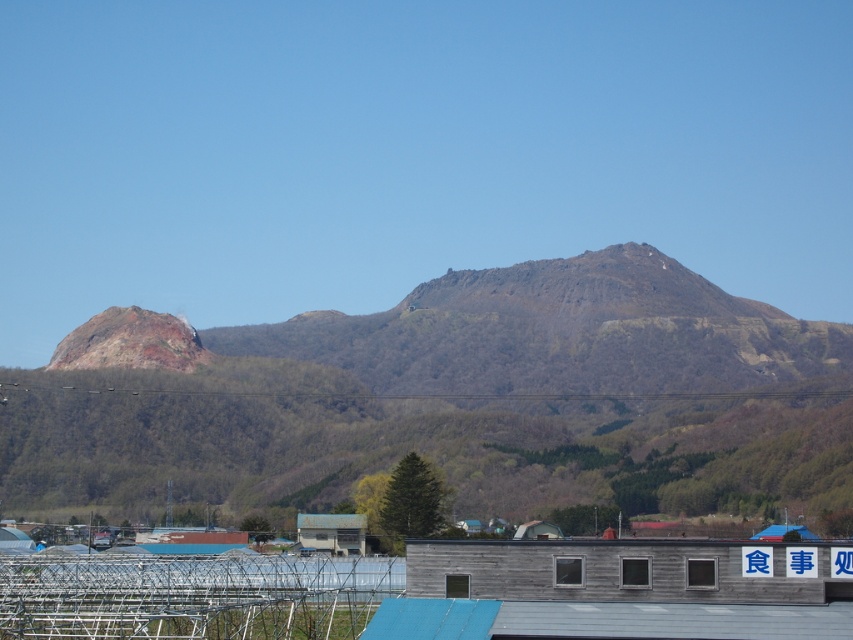
Question: Can you confirm if wooden hut at lower center is wider than rusty metallic rock at left?

Choices:
 (A) yes
 (B) no

Answer: (B)

Question: Does rustic brown mountain range at center appear on the left side of rusty metallic rock at left?

Choices:
 (A) no
 (B) yes

Answer: (A)

Question: Which point appears farthest from the camera in this image?

Choices:
 (A) (102, 342)
 (B) (358, 528)
 (C) (415, 292)

Answer: (C)

Question: Can you confirm if rustic brown mountain range at center is positioned above wooden hut at lower center?

Choices:
 (A) no
 (B) yes

Answer: (B)

Question: Among these points, which one is nearest to the camera?

Choices:
 (A) (167, 332)
 (B) (293, 371)

Answer: (A)

Question: Which of these objects is positioned farthest from the rusty metallic rock at left?

Choices:
 (A) rustic brown mountain range at center
 (B) wooden hut at center
 (C) wooden hut at lower center

Answer: (C)